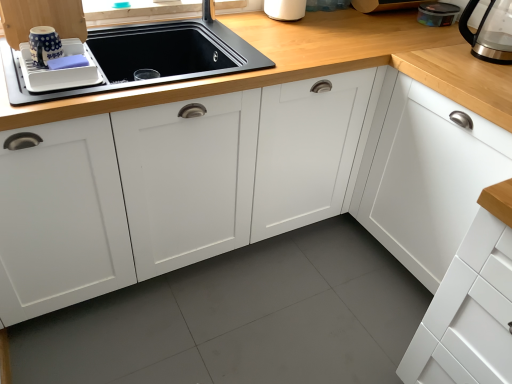
You are a GUI agent. You are given a task and a screenshot of the screen. Output one action in this format:
    pyautogui.click(x=<x>, y=<y>)
    Task: Click on the empty space that is ontop of white glossy cabinet at center, which is the second cabinetry from left to right
    The image size is (512, 384).
    Given the screenshot: What is the action you would take?
    pyautogui.click(x=270, y=34)